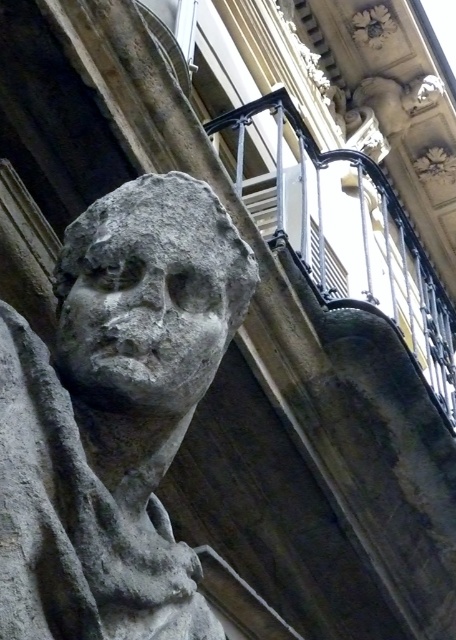
Question: Which point appears closest to the camera in this image?

Choices:
 (A) (37, 538)
 (B) (165, 307)

Answer: (A)

Question: Which object appears closest to the camera in this image?

Choices:
 (A) gray stone face at center
 (B) gray stone bust at center

Answer: (B)

Question: Where is gray stone bust at center located in relation to gray stone face at center in the image?

Choices:
 (A) above
 (B) below

Answer: (B)

Question: Does gray stone bust at center have a lesser width compared to gray stone face at center?

Choices:
 (A) no
 (B) yes

Answer: (A)

Question: Is gray stone bust at center positioned behind gray stone face at center?

Choices:
 (A) no
 (B) yes

Answer: (A)